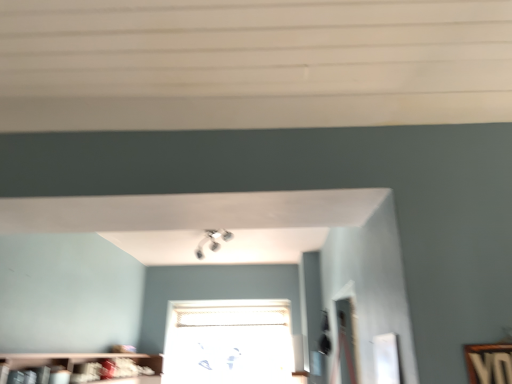
What do you see at coordinates (228, 342) in the screenshot?
I see `transparent glass window at center` at bounding box center [228, 342].

Where is `transparent glass window at center`? transparent glass window at center is located at coordinates (228, 342).

This screenshot has width=512, height=384. I want to click on wooden bookshelf at lower left, so click(76, 360).

From the picture: What is the approximate width of wooden bookshelf at lower left?

wooden bookshelf at lower left is 11.59 inches in width.

The height and width of the screenshot is (384, 512). What do you see at coordinates (76, 360) in the screenshot? I see `wooden bookshelf at lower left` at bounding box center [76, 360].

Where is `transparent glass window at center`? transparent glass window at center is located at coordinates [228, 342].

Is wooden bookshelf at lower left to the left of transparent glass window at center from the viewer's perspective?

Indeed, wooden bookshelf at lower left is positioned on the left side of transparent glass window at center.

Which is in front, wooden bookshelf at lower left or transparent glass window at center?

wooden bookshelf at lower left is more forward.

Between point (91, 356) and point (247, 308), which one is positioned behind?

The point (247, 308) is farther from the camera.

From the image's perspective, who appears lower, wooden bookshelf at lower left or transparent glass window at center?

transparent glass window at center is shown below in the image.

From a real-world perspective, is wooden bookshelf at lower left positioned over transparent glass window at center based on gravity?

No, from a real-world perspective, wooden bookshelf at lower left is not above transparent glass window at center.

Looking at this image, considering the sizes of objects wooden bookshelf at lower left and transparent glass window at center in the image provided, who is thinner, wooden bookshelf at lower left or transparent glass window at center?

Thinner between the two is transparent glass window at center.

Considering the relative sizes of wooden bookshelf at lower left and transparent glass window at center in the image provided, is wooden bookshelf at lower left taller than transparent glass window at center?

Incorrect, the height of wooden bookshelf at lower left is not larger of that of transparent glass window at center.

Considering the relative sizes of wooden bookshelf at lower left and transparent glass window at center in the image provided, is wooden bookshelf at lower left smaller than transparent glass window at center?

Incorrect, wooden bookshelf at lower left is not smaller in size than transparent glass window at center.

Can transparent glass window at center be found inside wooden bookshelf at lower left?

No, transparent glass window at center is located outside of wooden bookshelf at lower left.

Does wooden bookshelf at lower left touch transparent glass window at center?

No.

In the scene shown: Is wooden bookshelf at lower left facing towards transparent glass window at center?

No, wooden bookshelf at lower left is not oriented towards transparent glass window at center.

How many degrees apart are the facing directions of wooden bookshelf at lower left and transparent glass window at center?

The angular difference between wooden bookshelf at lower left and transparent glass window at center is 90.7 degrees.

What are the coordinates of `window above the wooden bookshelf at lower left (from a real-world perspective)` in the screenshot? It's located at (228, 342).

Between transparent glass window at center and wooden bookshelf at lower left, which one appears on the right side from the viewer's perspective?

From the viewer's perspective, transparent glass window at center appears more on the right side.

Is transparent glass window at center positioned behind wooden bookshelf at lower left?

That is True.

Does point (226, 363) appear closer or farther from the camera than point (67, 361)?

Clearly, point (226, 363) is more distant from the camera than point (67, 361).

From the image's perspective, is transparent glass window at center located above or below wooden bookshelf at lower left?

transparent glass window at center is situated lower than wooden bookshelf at lower left in the image.

From a real-world perspective, is transparent glass window at center located beneath wooden bookshelf at lower left?

Incorrect, from a real-world perspective, transparent glass window at center is higher than wooden bookshelf at lower left.

Considering the relative sizes of transparent glass window at center and wooden bookshelf at lower left in the image provided, is transparent glass window at center wider than wooden bookshelf at lower left?

In fact, transparent glass window at center might be narrower than wooden bookshelf at lower left.

Who is shorter, transparent glass window at center or wooden bookshelf at lower left?

With less height is wooden bookshelf at lower left.

Is transparent glass window at center bigger than wooden bookshelf at lower left?

No.

Is wooden bookshelf at lower left a part of transparent glass window at center?

No, transparent glass window at center does not contain wooden bookshelf at lower left.

Is transparent glass window at center not close to wooden bookshelf at lower left?

That's not correct — transparent glass window at center is a little close to wooden bookshelf at lower left.

Is transparent glass window at center looking in the opposite direction of wooden bookshelf at lower left?

transparent glass window at center does not have its back to wooden bookshelf at lower left.

How many degrees apart are the facing directions of transparent glass window at center and wooden bookshelf at lower left?

90.7 degrees.

Locate an element on the screen. The image size is (512, 384). window that appears above the wooden bookshelf at lower left (from a real-world perspective) is located at coordinates (228, 342).

Where is `window behind the wooden bookshelf at lower left`? This screenshot has width=512, height=384. window behind the wooden bookshelf at lower left is located at coordinates (228, 342).

Locate an element on the screen. The height and width of the screenshot is (384, 512). window above the wooden bookshelf at lower left (from a real-world perspective) is located at coordinates (228, 342).